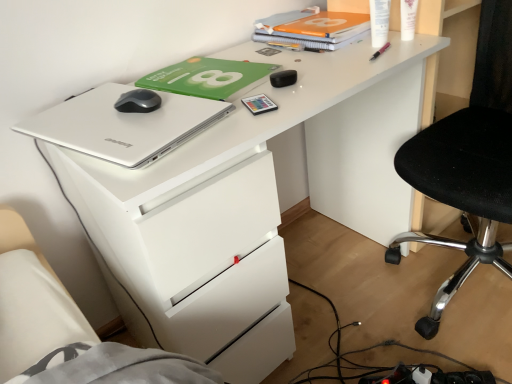
This screenshot has height=384, width=512. Identify the location of free space that is in between green matte paperback book at upper center and white glossy lotion at upper right, the first stationery when ordered from right to left. [x=307, y=59].